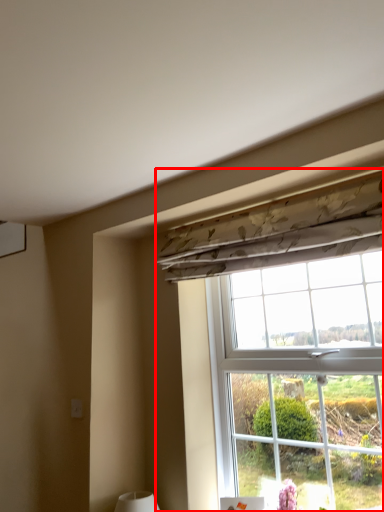
Question: From the image's perspective, what is the correct spatial relationship of window (annotated by the red box) in relation to curtain?

Choices:
 (A) above
 (B) below

Answer: (B)